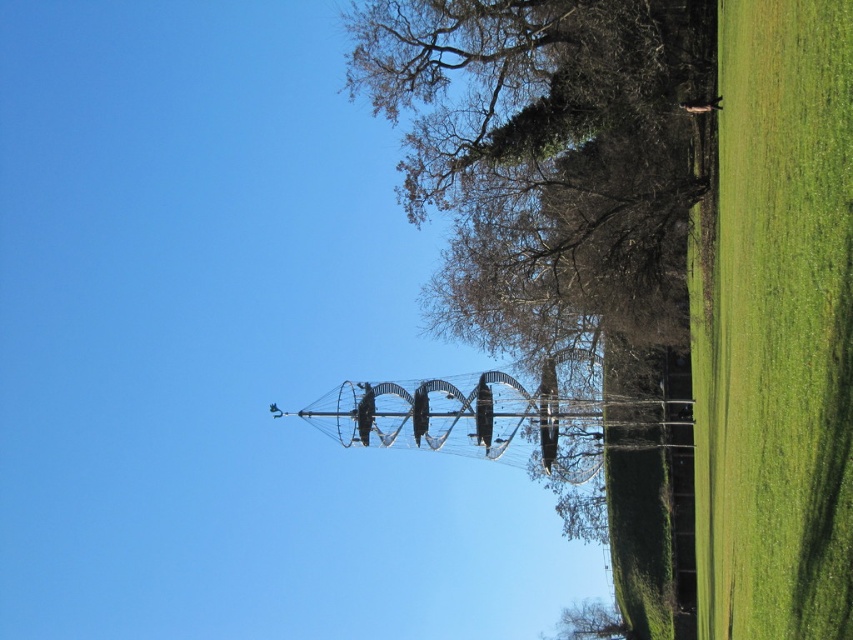
Question: Which object is farther from the camera taking this photo?

Choices:
 (A) green grass at right
 (B) green leafy tree at lower center

Answer: (B)

Question: Which of the following is the closest to the observer?

Choices:
 (A) (612, 614)
 (B) (720, 627)

Answer: (B)

Question: In this image, where is green grass at right located relative to green leafy tree at lower center?

Choices:
 (A) below
 (B) above

Answer: (B)

Question: From the image, what is the correct spatial relationship of green grass at right in relation to green leafy tree at lower center?

Choices:
 (A) above
 (B) below

Answer: (A)

Question: Does green grass at right have a lesser width compared to green leafy tree at lower center?

Choices:
 (A) yes
 (B) no

Answer: (A)